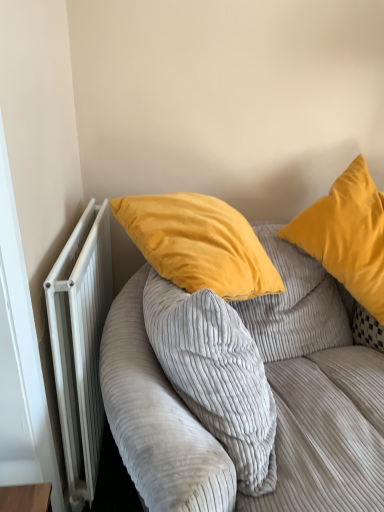
Question: Is velvet yellow pillow at upper right positioned before corduroy fabric couch at upper right?

Choices:
 (A) yes
 (B) no

Answer: (B)

Question: Can you see velvet yellow pillow at upper right touching corduroy fabric couch at upper right?

Choices:
 (A) yes
 (B) no

Answer: (B)

Question: Considering the relative sizes of velvet yellow pillow at upper right and corduroy fabric couch at upper right in the image provided, is velvet yellow pillow at upper right wider than corduroy fabric couch at upper right?

Choices:
 (A) no
 (B) yes

Answer: (A)

Question: Is velvet yellow pillow at upper right oriented towards corduroy fabric couch at upper right?

Choices:
 (A) yes
 (B) no

Answer: (A)

Question: Does velvet yellow pillow at upper right appear on the left side of corduroy fabric couch at upper right?

Choices:
 (A) yes
 (B) no

Answer: (B)

Question: Relative to white metallic radiator at left, is velvet yellow pillow at upper right in front or behind?

Choices:
 (A) front
 (B) behind

Answer: (B)

Question: From the image's perspective, is velvet yellow pillow at upper right positioned above or below white metallic radiator at left?

Choices:
 (A) below
 (B) above

Answer: (B)

Question: Does point (374, 239) appear closer or farther from the camera than point (99, 237)?

Choices:
 (A) farther
 (B) closer

Answer: (B)

Question: Is velvet yellow pillow at upper right to the left or to the right of white metallic radiator at left in the image?

Choices:
 (A) right
 (B) left

Answer: (A)

Question: Is white metallic radiator at left taller or shorter than corduroy fabric couch at upper right?

Choices:
 (A) tall
 (B) short

Answer: (B)

Question: Would you say white metallic radiator at left is to the left or to the right of corduroy fabric couch at upper right in the picture?

Choices:
 (A) right
 (B) left

Answer: (B)

Question: Considering their positions, is white metallic radiator at left located in front of or behind corduroy fabric couch at upper right?

Choices:
 (A) behind
 (B) front

Answer: (A)

Question: From the image's perspective, is white metallic radiator at left located above or below corduroy fabric couch at upper right?

Choices:
 (A) below
 (B) above

Answer: (B)

Question: Is white metallic radiator at left bigger or smaller than velvet yellow pillow at upper right?

Choices:
 (A) big
 (B) small

Answer: (B)

Question: Is white metallic radiator at left in front of or behind velvet yellow pillow at upper right in the image?

Choices:
 (A) front
 (B) behind

Answer: (A)